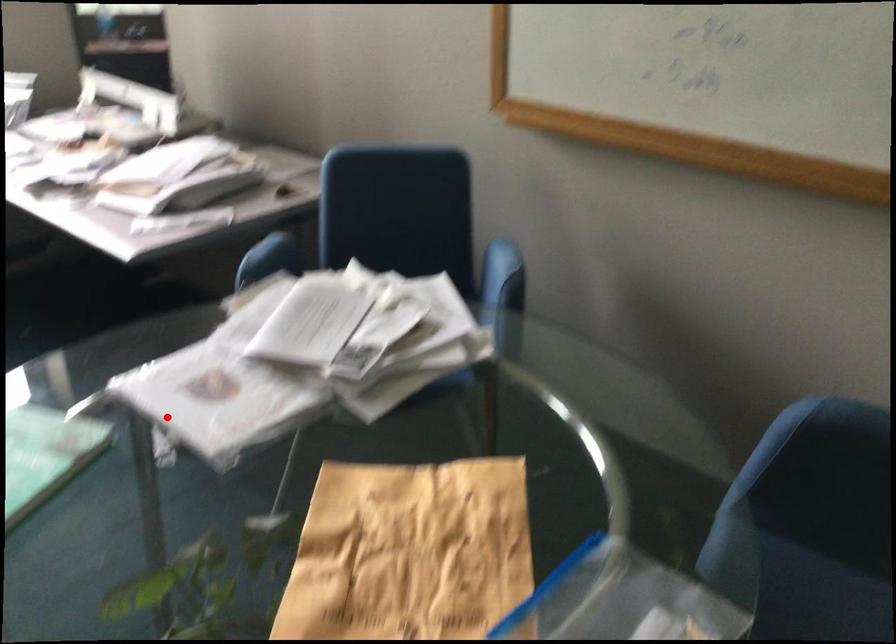
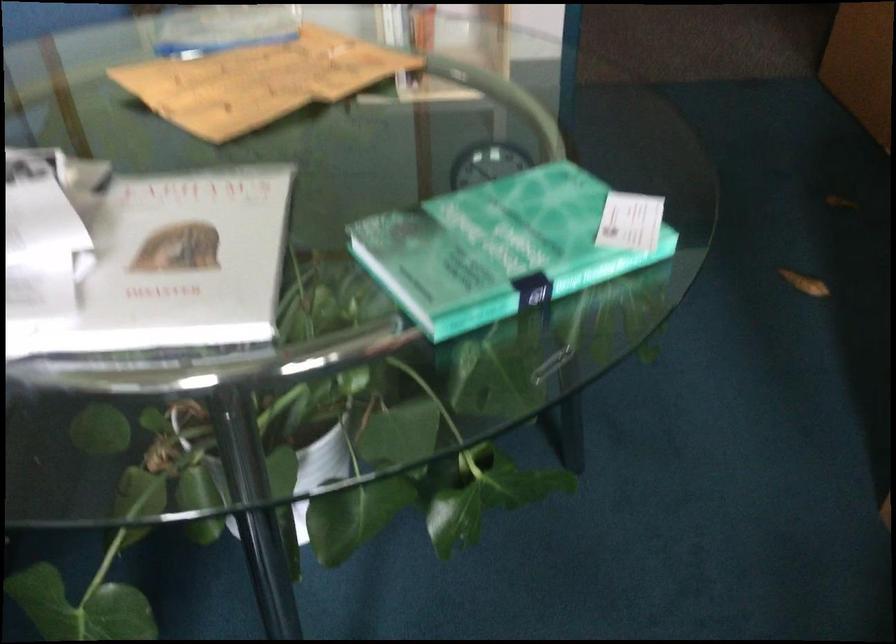
Question: I am providing you with two images of the same scene from different viewpoints. In image1, a red point is highlighted. Considering the same 3D point in image2, which of the following is correct?

Choices:
 (A) It is closer
 (B) It is farther

Answer: (A)